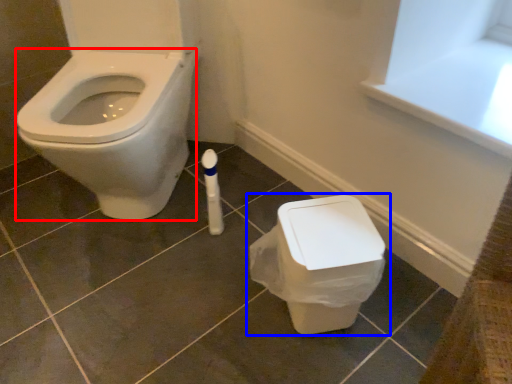
Question: Among these objects, which one is farthest to the camera, bidet (highlighted by a red box) or toilet (highlighted by a blue box)?

Choices:
 (A) bidet
 (B) toilet

Answer: (B)